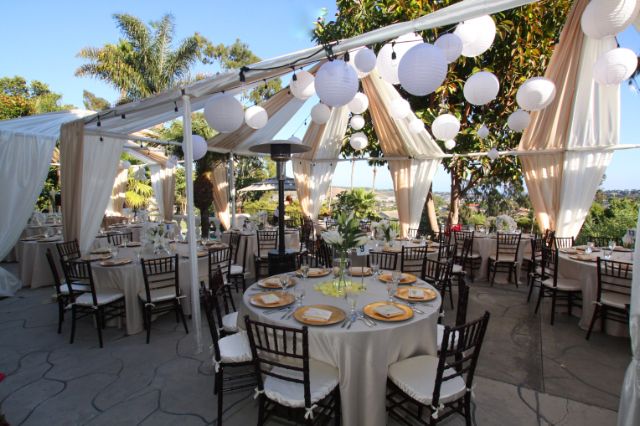
Locate an element on the screen. This screenshot has width=640, height=426. circular tables is located at coordinates (594, 272), (522, 241), (395, 245), (369, 296), (134, 267), (252, 241), (36, 251), (31, 229), (182, 214).